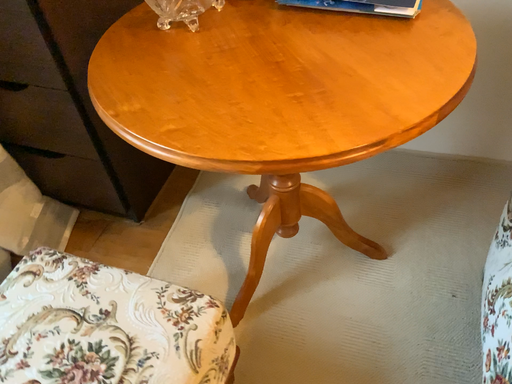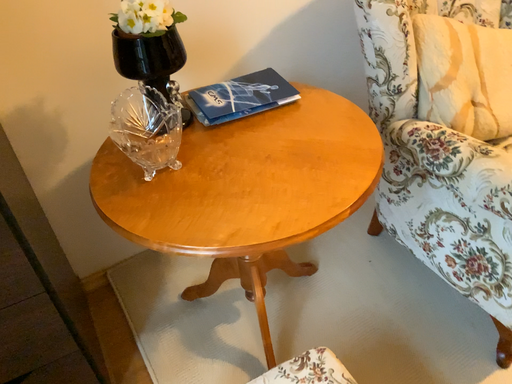
Question: Which way did the camera rotate in the video?

Choices:
 (A) rotated left
 (B) rotated right

Answer: (B)